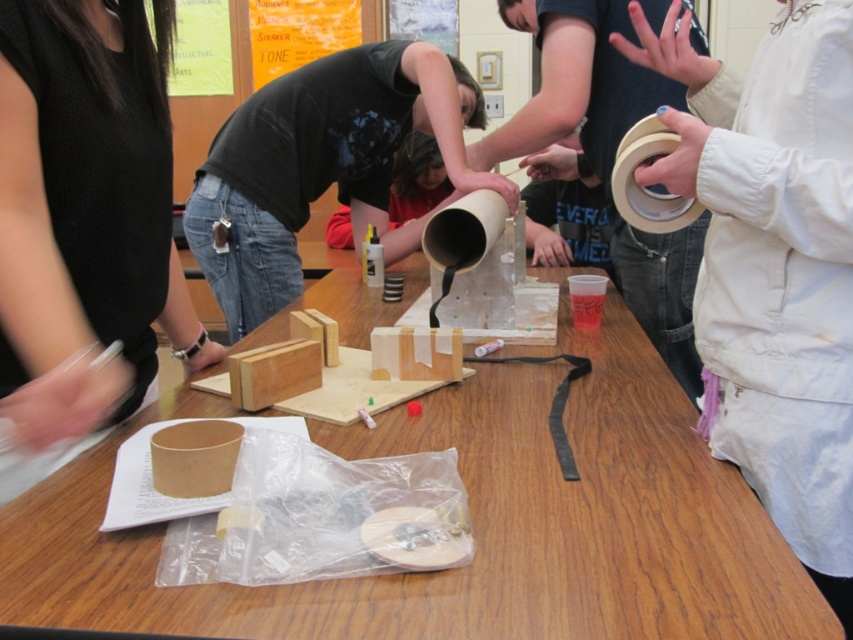
You are standing at the back of the room and want to hand a tool to the person wearing the black matte shirt at center. Can you directly hand it to them without stepping around the wooden table at center?

The wooden table at center is in front of the black matte shirt at center, so you would need to step around the wooden table at center to reach the person directly.

You are standing at the origin point of the coordinate system. Can you determine the direction of the wooden table at center relative to your position?

The wooden table at center is located at point [473,524], which is northeast of the origin point. Therefore, the wooden table at center is northeast of your position.

You are a participant at the workshop and need to place a 1.5 meter long tool on the wooden table at center. Considering the table and the black matte shirt at center, can the tool fit on the table without overlapping the shirt?

The wooden table at center is wider than the black matte shirt at center. Since the table is wider, there should be enough space to place the 1.5 meter long tool on the wooden table at center without overlapping the black matte shirt at center, provided the tool is placed appropriately.